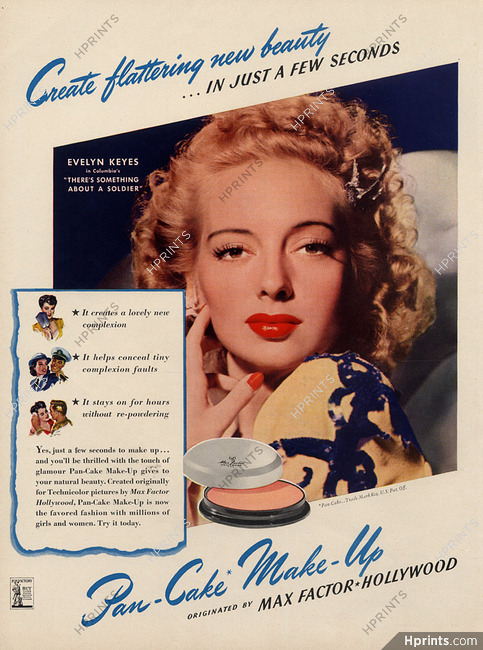
You are a GUI agent. You are given a task and a screenshot of the screen. Output one action in this format:
    pyautogui.click(x=<x>, y=<y>)
    Task: Click on the makeup
    The image size is (483, 650).
    Given the screenshot: What is the action you would take?
    pyautogui.click(x=248, y=506)